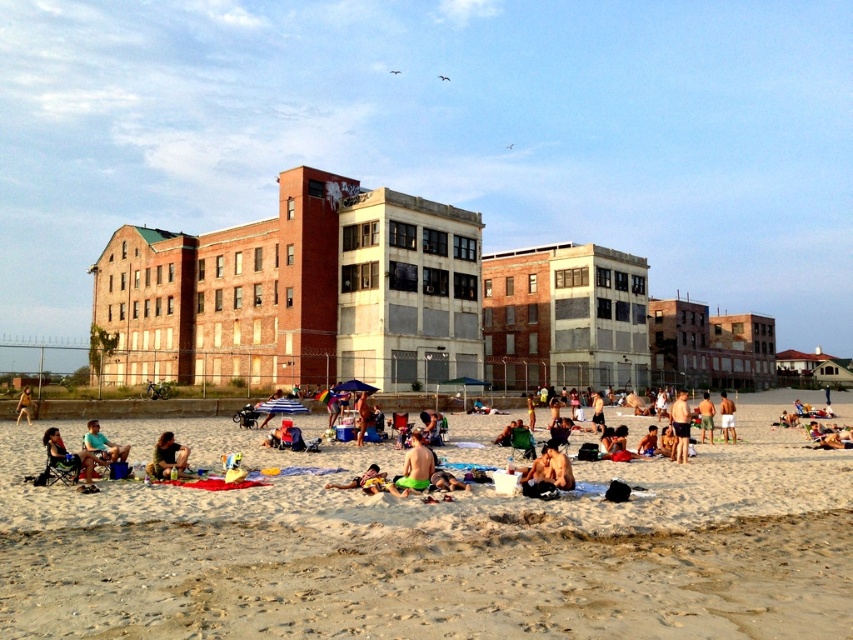
Question: Which object is farther from the camera taking this photo?

Choices:
 (A) green matte shorts at center
 (B) smooth tan skin at center
 (C) brown fabric bag at center
 (D) brown leather jacket at lower left

Answer: (D)

Question: Does beige sand at center appear under green fabric shorts at center?

Choices:
 (A) yes
 (B) no

Answer: (B)

Question: Does tan skin man at center have a larger size compared to green shorts at center?

Choices:
 (A) yes
 (B) no

Answer: (B)

Question: Among these objects, which one is farthest from the camera?

Choices:
 (A) matte black chair at lower left
 (B) smooth tan skin at center
 (C) brown fabric bag at center

Answer: (B)

Question: Is green matte shorts at center above smooth tan skin at center?

Choices:
 (A) yes
 (B) no

Answer: (B)

Question: Which of the following is the closest to the observer?

Choices:
 (A) (19, 413)
 (B) (56, 460)

Answer: (B)